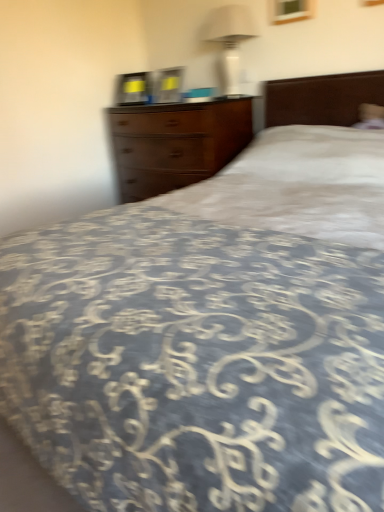
Question: Looking at the image, does wooden chest of drawers at center seem bigger or smaller compared to white glossy lampshade at upper center?

Choices:
 (A) small
 (B) big

Answer: (B)

Question: Is wooden chest of drawers at center inside the boundaries of white glossy lampshade at upper center, or outside?

Choices:
 (A) inside
 (B) outside

Answer: (B)

Question: Considering the positions of wooden chest of drawers at center and white glossy lampshade at upper center in the image, is wooden chest of drawers at center taller or shorter than white glossy lampshade at upper center?

Choices:
 (A) short
 (B) tall

Answer: (B)

Question: Considering the positions of white glossy lampshade at upper center and wooden chest of drawers at center in the image, is white glossy lampshade at upper center wider or thinner than wooden chest of drawers at center?

Choices:
 (A) wide
 (B) thin

Answer: (B)

Question: Is white glossy lampshade at upper center bigger or smaller than wooden chest of drawers at center?

Choices:
 (A) small
 (B) big

Answer: (A)

Question: From a real-world perspective, is white glossy lampshade at upper center positioned above or below wooden chest of drawers at center?

Choices:
 (A) above
 (B) below

Answer: (A)

Question: Considering the positions of white glossy lampshade at upper center and wooden chest of drawers at center in the image, is white glossy lampshade at upper center taller or shorter than wooden chest of drawers at center?

Choices:
 (A) tall
 (B) short

Answer: (B)